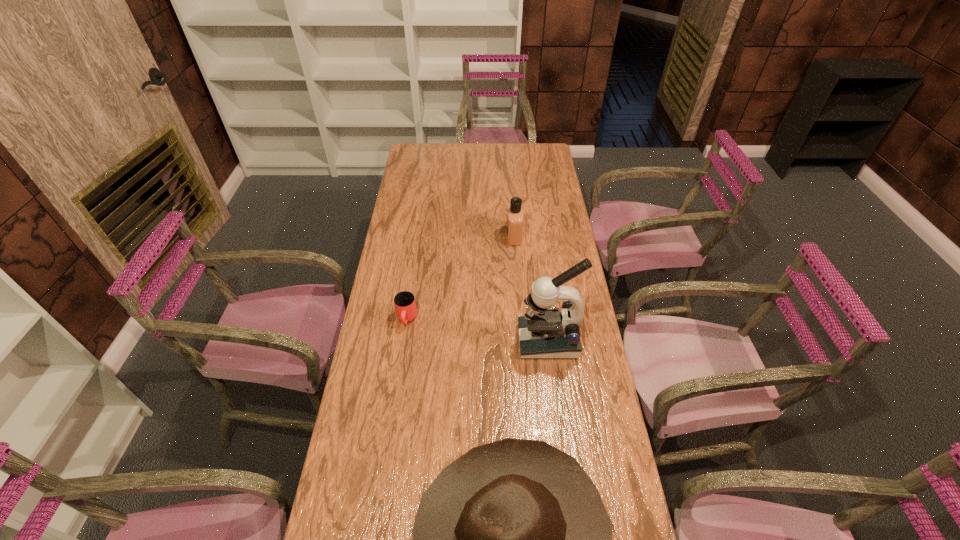
The width and height of the screenshot is (960, 540). Identify the location of microscope. (544, 333).

Where is `the farthest object`? the farthest object is located at coordinates (514, 219).

Find the location of a particular element. cup is located at coordinates (405, 306).

You are a GUI agent. You are given a task and a screenshot of the screen. Output one action in this format:
    pyautogui.click(x=<x>, y=<y>)
    Task: Click on the shortest object
    The height and width of the screenshot is (540, 960).
    Given the screenshot: What is the action you would take?
    pyautogui.click(x=405, y=306)

Locate an element on the screen. vacant area located on the left of the microscope is located at coordinates (428, 341).

Where is `vacant space situated on the front label of the perfume`? vacant space situated on the front label of the perfume is located at coordinates (439, 235).

Image resolution: width=960 pixels, height=540 pixels. Find the location of `vacant space located 0.160m on the front label of the perfume`. vacant space located 0.160m on the front label of the perfume is located at coordinates (468, 235).

Identify the location of vacant space located 0.370m on the front label of the perfume. (417, 235).

Locate an element on the screen. The height and width of the screenshot is (540, 960). blank space located on the handle side of the leftmost object is located at coordinates (390, 437).

This screenshot has height=540, width=960. I want to click on object positioned at the left edge, so click(x=405, y=306).